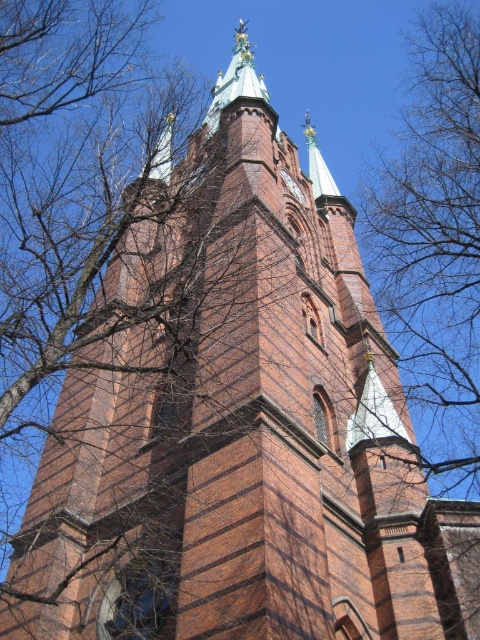
Which is more to the right, bare branches at upper right or polished brass clock at upper center?

From the viewer's perspective, bare branches at upper right appears more on the right side.

Is point (425, 308) more distant than point (292, 195)?

That is True.

Between point (391, 204) and point (302, 196), which one is positioned behind?

Point (391, 204)

In order to click on bare branches at upper right in this screenshot , I will do `click(434, 243)`.